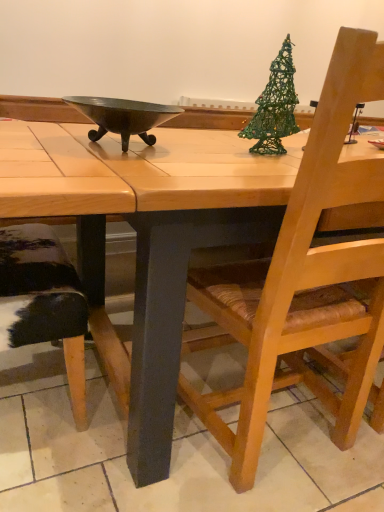
Question: Which is correct: metallic dark gray bowl at center is inside green wire christmas tree at upper right, or outside of it?

Choices:
 (A) inside
 (B) outside

Answer: (B)

Question: Is metallic dark gray bowl at center taller or shorter than green wire christmas tree at upper right?

Choices:
 (A) tall
 (B) short

Answer: (B)

Question: Which object is the farthest from the wooden chair with woven seat at right?

Choices:
 (A) metallic dark gray bowl at center
 (B) wooden table at center
 (C) green wire christmas tree at upper right

Answer: (A)

Question: Which of these objects is positioned closest to the metallic dark gray bowl at center?

Choices:
 (A) green wire christmas tree at upper right
 (B) wooden table at center
 (C) wooden chair with woven seat at right

Answer: (B)